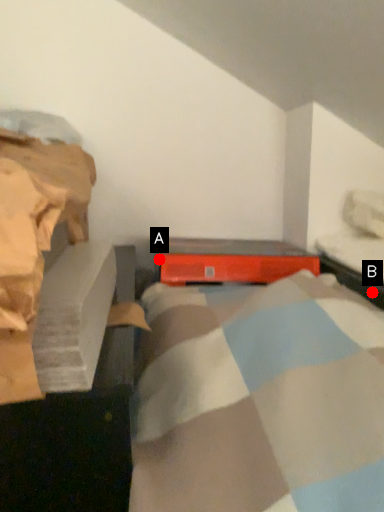
Question: Two points are circled on the image, labeled by A and B beside each circle. Which point appears farthest from the camera in this image?

Choices:
 (A) A is further
 (B) B is further

Answer: (A)